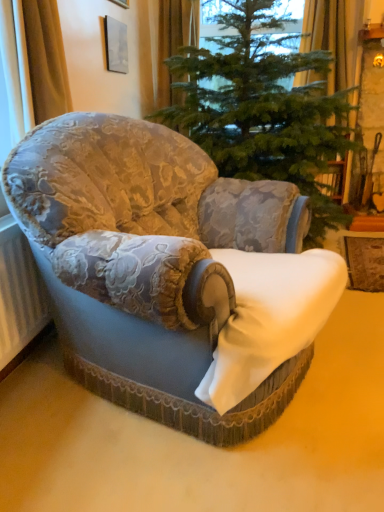
Question: From the image's perspective, is yellow fabric curtain at upper right, arranged as the 2th curtain when viewed from the back, under green textured christmas tree at center?

Choices:
 (A) yes
 (B) no

Answer: (B)

Question: Is the depth of yellow fabric curtain at upper right, the 2th curtain from the front, greater than that of green textured christmas tree at center?

Choices:
 (A) no
 (B) yes

Answer: (B)

Question: From a real-world perspective, is yellow fabric curtain at upper right, which ranks as the 1th curtain in right-to-left order, physically below green textured christmas tree at center?

Choices:
 (A) no
 (B) yes

Answer: (A)

Question: Is yellow fabric curtain at upper right, the 3th curtain from the left, outside green textured christmas tree at center?

Choices:
 (A) no
 (B) yes

Answer: (B)

Question: Considering the relative sizes of yellow fabric curtain at upper right, arranged as the 2th curtain when viewed from the back, and green textured christmas tree at center in the image provided, is yellow fabric curtain at upper right, arranged as the 2th curtain when viewed from the back, taller than green textured christmas tree at center?

Choices:
 (A) yes
 (B) no

Answer: (B)

Question: Is white textured radiator at lower left to the left or to the right of orange fabric curtain at upper center, the second curtain from the right, in the image?

Choices:
 (A) right
 (B) left

Answer: (B)

Question: From a real-world perspective, is white textured radiator at lower left positioned above or below orange fabric curtain at upper center, the first curtain positioned from the back?

Choices:
 (A) below
 (B) above

Answer: (A)

Question: Would you say white textured radiator at lower left is inside or outside orange fabric curtain at upper center, positioned as the second curtain in left-to-right order?

Choices:
 (A) inside
 (B) outside

Answer: (B)

Question: From the image's perspective, is white textured radiator at lower left above or below orange fabric curtain at upper center, positioned as the second curtain in left-to-right order?

Choices:
 (A) above
 (B) below

Answer: (B)

Question: Is point (1, 362) positioned closer to the camera than point (130, 122)?

Choices:
 (A) closer
 (B) farther

Answer: (A)

Question: From their relative heights in the image, would you say white textured radiator at lower left is taller or shorter than velvet floral armchair at center?

Choices:
 (A) short
 (B) tall

Answer: (A)

Question: From the image's perspective, is white textured radiator at lower left located above or below velvet floral armchair at center?

Choices:
 (A) above
 (B) below

Answer: (B)

Question: Is white textured radiator at lower left wider or thinner than velvet floral armchair at center?

Choices:
 (A) wide
 (B) thin

Answer: (B)

Question: Is point (26, 330) closer or farther from the camera than point (284, 148)?

Choices:
 (A) farther
 (B) closer

Answer: (B)

Question: Is white textured radiator at lower left bigger or smaller than green textured christmas tree at center?

Choices:
 (A) small
 (B) big

Answer: (A)